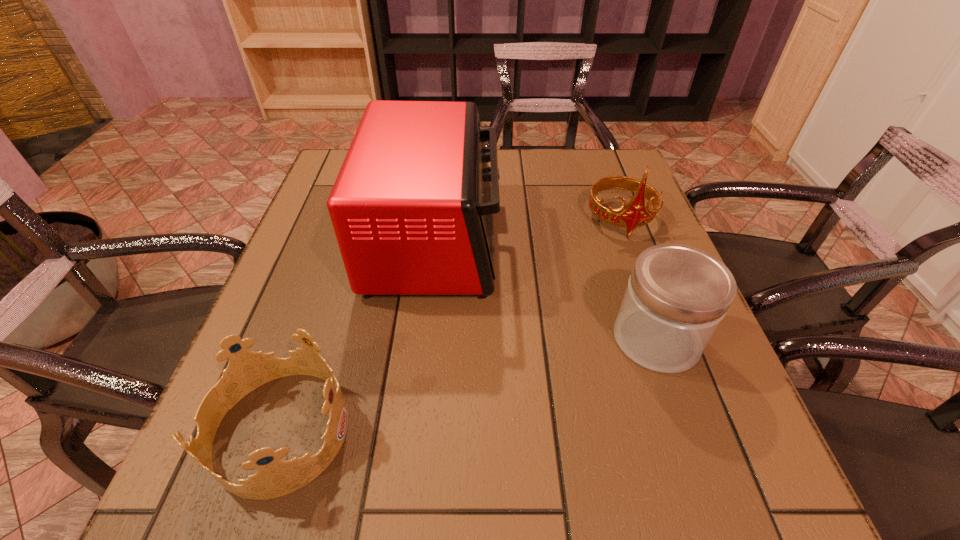
Identify which object is the closest to the left tiara. Please provide its 2D coordinates. Your answer should be formatted as a tuple, i.e. [(x, y)], where the tuple contains the x and y coordinates of a point satisfying the conditions above.

[(412, 207)]

Identify the location of vacant area in the image that satisfies the following two spatial constraints: 1. on the front-facing side of the toaster oven; 2. on the back side of the jar. The height and width of the screenshot is (540, 960). (424, 339).

Identify the location of free spot that satisfies the following two spatial constraints: 1. on the front-facing side of the taller tiara; 2. on the front-facing side of the nearer tiara. The image size is (960, 540). (698, 430).

You are a GUI agent. You are given a task and a screenshot of the screen. Output one action in this format:
    pyautogui.click(x=<x>, y=<y>)
    Task: Click on the free location that satisfies the following two spatial constraints: 1. on the front-facing side of the right tiara; 2. on the front-facing side of the shortest object
    
    Given the screenshot: What is the action you would take?
    pyautogui.click(x=698, y=430)

At what (x,y) coordinates should I click in order to perform the action: click on vacant space that satisfies the following two spatial constraints: 1. on the front-facing side of the toaster oven; 2. on the back side of the jar. Please return your answer as a coordinate pair (x, y). This screenshot has width=960, height=540. Looking at the image, I should click on (424, 339).

You are a GUI agent. You are given a task and a screenshot of the screen. Output one action in this format:
    pyautogui.click(x=<x>, y=<y>)
    Task: Click on the vacant space that satisfies the following two spatial constraints: 1. on the front-facing side of the farther tiara; 2. on the front-facing side of the tallest object
    Image resolution: width=960 pixels, height=540 pixels.
    Given the screenshot: What is the action you would take?
    pyautogui.click(x=628, y=240)

This screenshot has height=540, width=960. I want to click on free space that satisfies the following two spatial constraints: 1. on the front-facing side of the taller tiara; 2. on the front-facing side of the nearer tiara, so click(698, 430).